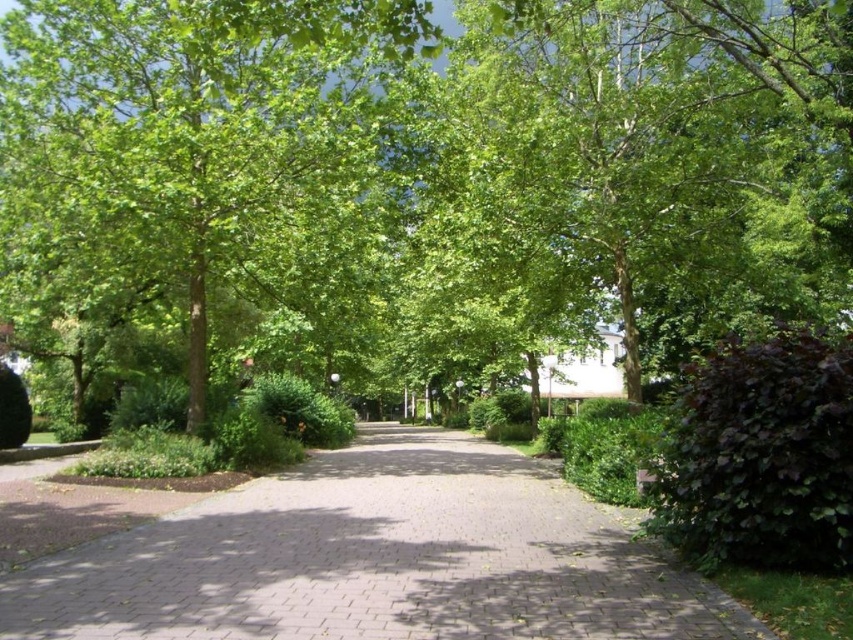
Question: Estimate the real-world distances between objects in this image. Which object is farther from the green leafy tree at center?

Choices:
 (A) dark purple leafy bush at right
 (B) green leafy bush at center

Answer: (A)

Question: Among these points, which one is farthest from the camera?

Choices:
 (A) (178, 108)
 (B) (724, 513)

Answer: (A)

Question: Does dark purple leafy bush at right appear over green leafy bush at center?

Choices:
 (A) no
 (B) yes

Answer: (B)

Question: Does dark purple leafy bush at right have a greater width compared to green leafy bush at center?

Choices:
 (A) no
 (B) yes

Answer: (A)

Question: Which point appears farthest from the camera in this image?

Choices:
 (A) (44, 77)
 (B) (544, 513)
 (C) (315, 401)
 (D) (801, 353)

Answer: (C)

Question: Does green leafy tree at center have a larger size compared to green leafy bush at center?

Choices:
 (A) no
 (B) yes

Answer: (B)